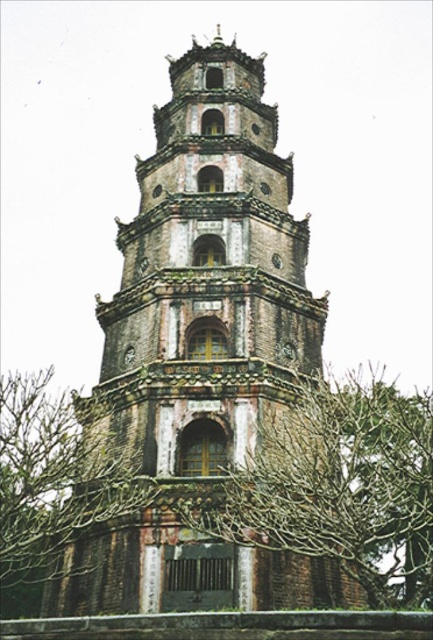
Which is below, brown leafless branches at center or brown textured tree at lower left?

brown textured tree at lower left is lower down.

What do you see at coordinates (338, 484) in the screenshot? The image size is (433, 640). I see `brown leafless branches at center` at bounding box center [338, 484].

Who is more distant from viewer, (x=265, y=417) or (x=32, y=580)?

The point (x=32, y=580) is more distant.

At what (x,y) coordinates should I click in order to perform the action: click on brown leafless branches at center. Please return your answer as a coordinate pair (x, y). This screenshot has height=640, width=433. Looking at the image, I should click on (338, 484).

Between brown stone tower at center and brown textured tree at lower left, which one is positioned lower?

Positioned lower is brown textured tree at lower left.

The height and width of the screenshot is (640, 433). What do you see at coordinates (209, 273) in the screenshot?
I see `brown stone tower at center` at bounding box center [209, 273].

Identify the location of brown stone tower at center. The height and width of the screenshot is (640, 433). (209, 273).

Which is more to the left, brown stone tower at center or brown leafless branches at center?

brown stone tower at center is more to the left.

In the scene shown: Is brown stone tower at center further to camera compared to brown leafless branches at center?

Yes, it is behind brown leafless branches at center.

Between point (104, 368) and point (359, 458), which one is positioned behind?

The point (359, 458) is behind.

At what (x,y) coordinates should I click in order to perform the action: click on brown stone tower at center. Please return your answer as a coordinate pair (x, y). Looking at the image, I should click on (209, 273).